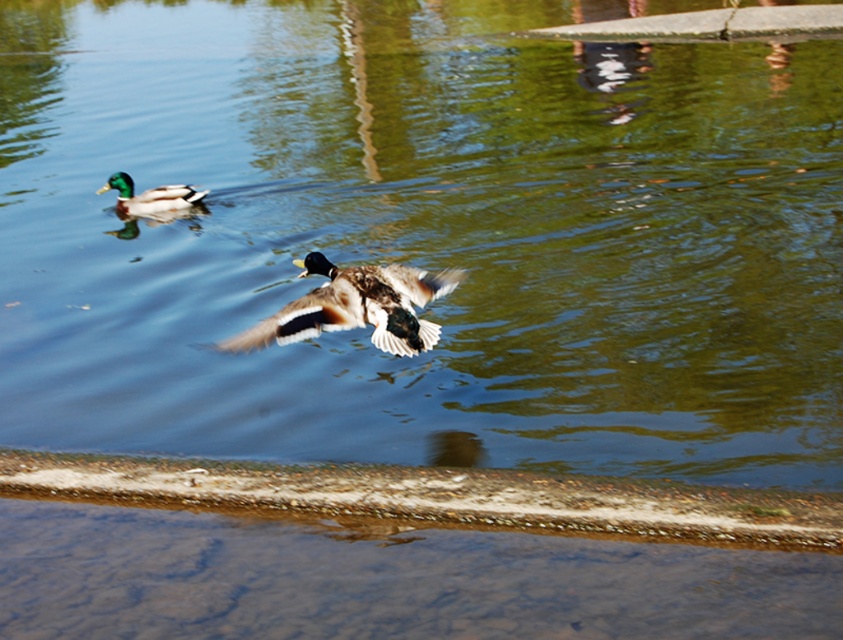
Which of these two, brown speckled feathers at center or green glossy duck at upper left, stands shorter?

With less height is green glossy duck at upper left.

Can you confirm if brown speckled feathers at center is thinner than green glossy duck at upper left?

Yes.

Between point (345, 324) and point (119, 205), which one is positioned behind?

The point (119, 205) is behind.

Identify the location of brown speckled feathers at center. (356, 307).